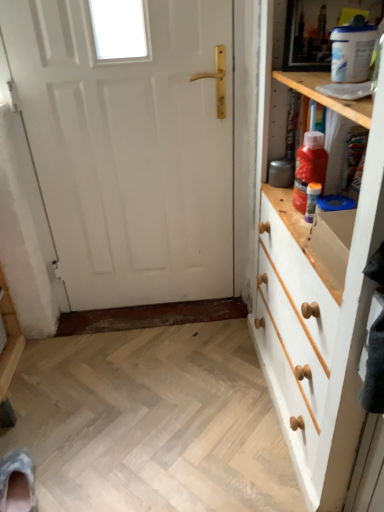
Question: Considering the relative positions of red plastic bottle at upper right, arranged as the first bottle when viewed from the top, and white painted wood chest of drawers at right in the image provided, is red plastic bottle at upper right, arranged as the first bottle when viewed from the top, to the left or to the right of white painted wood chest of drawers at right?

Choices:
 (A) left
 (B) right

Answer: (A)

Question: Is red plastic bottle at upper right, the 2th bottle in the bottom-to-top sequence, wider or thinner than white painted wood chest of drawers at right?

Choices:
 (A) thin
 (B) wide

Answer: (A)

Question: Which object is positioned farthest from the red plastic bottle at upper right, the 2th bottle in the bottom-to-top sequence?

Choices:
 (A) white painted wood chest of drawers at right
 (B) translucent plastic bottle at upper right, which is the second bottle from top to bottom
 (C) camouflage fabric shoe at lower left
 (D) white matte door at center

Answer: (C)

Question: Which object is positioned farthest from the white matte door at center?

Choices:
 (A) camouflage fabric shoe at lower left
 (B) red plastic bottle at upper right, arranged as the first bottle when viewed from the top
 (C) white painted wood chest of drawers at right
 (D) translucent plastic bottle at upper right, which is counted as the first bottle, starting from the bottom

Answer: (A)